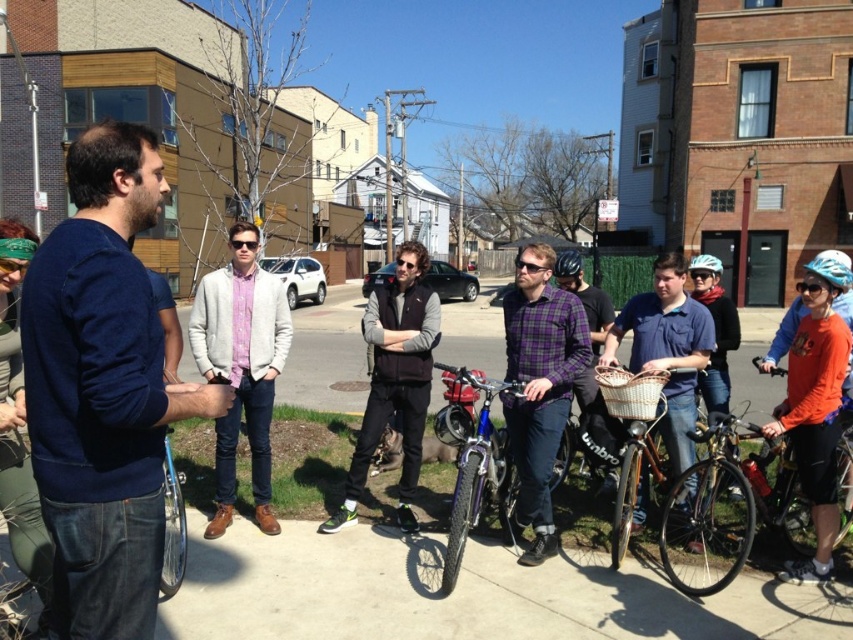
Is dark blue sweater at left above matte purple shirt at center?

No, dark blue sweater at left is not above matte purple shirt at center.

Is dark blue sweater at left smaller than matte purple shirt at center?

Actually, dark blue sweater at left might be larger than matte purple shirt at center.

I want to click on dark blue sweater at left, so click(x=102, y=390).

Image resolution: width=853 pixels, height=640 pixels. Describe the element at coordinates (459, 593) in the screenshot. I see `gray concrete pavement at center` at that location.

Which is more to the right, gray concrete pavement at center or matte black bicycle helmet at center?

From the viewer's perspective, matte black bicycle helmet at center appears more on the right side.

Describe the element at coordinates (459, 593) in the screenshot. The image size is (853, 640). I see `gray concrete pavement at center` at that location.

At what (x,y) coordinates should I click in order to perform the action: click on gray concrete pavement at center. Please return your answer as a coordinate pair (x, y). Looking at the image, I should click on (459, 593).

Which is more to the left, gray concrete pavement at center or white matte bicycle helmet at upper center?

Positioned to the left is gray concrete pavement at center.

Is gray concrete pavement at center wider than white matte bicycle helmet at upper center?

Correct, the width of gray concrete pavement at center exceeds that of white matte bicycle helmet at upper center.

Does point (583, 576) come closer to viewer compared to point (718, 266)?

Yes, it is.

At what (x,y) coordinates should I click in order to perform the action: click on gray concrete pavement at center. Please return your answer as a coordinate pair (x, y). Looking at the image, I should click on (459, 593).